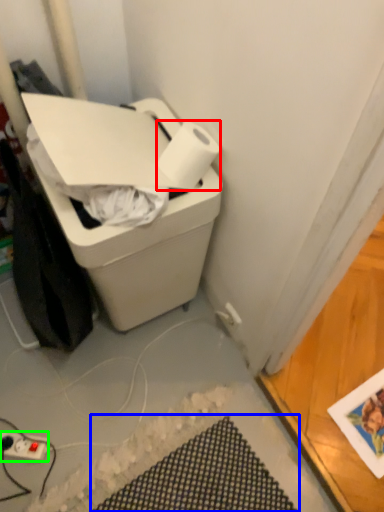
Question: Considering the real-world distances, which object is farthest from paper towel (highlighted by a red box)? bath mat (highlighted by a blue box) or power plugs and sockets (highlighted by a green box)?

Choices:
 (A) bath mat
 (B) power plugs and sockets

Answer: (B)